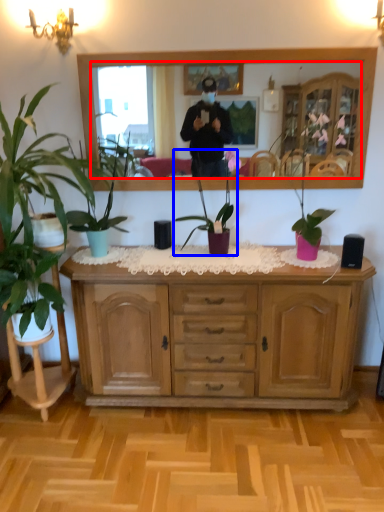
Question: Which of the following is the farthest to the observer, mirror (highlighted by a red box) or houseplant (highlighted by a blue box)?

Choices:
 (A) mirror
 (B) houseplant

Answer: (A)